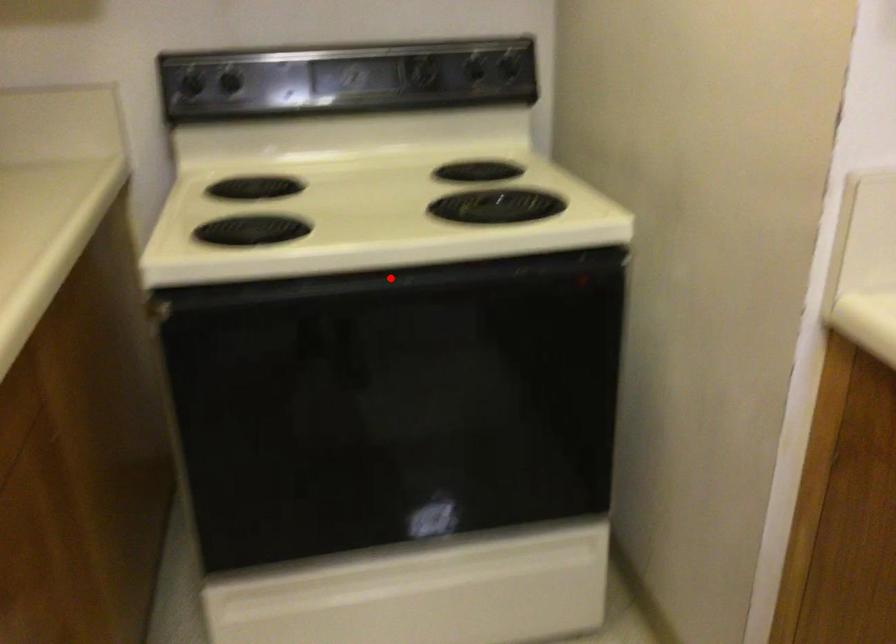
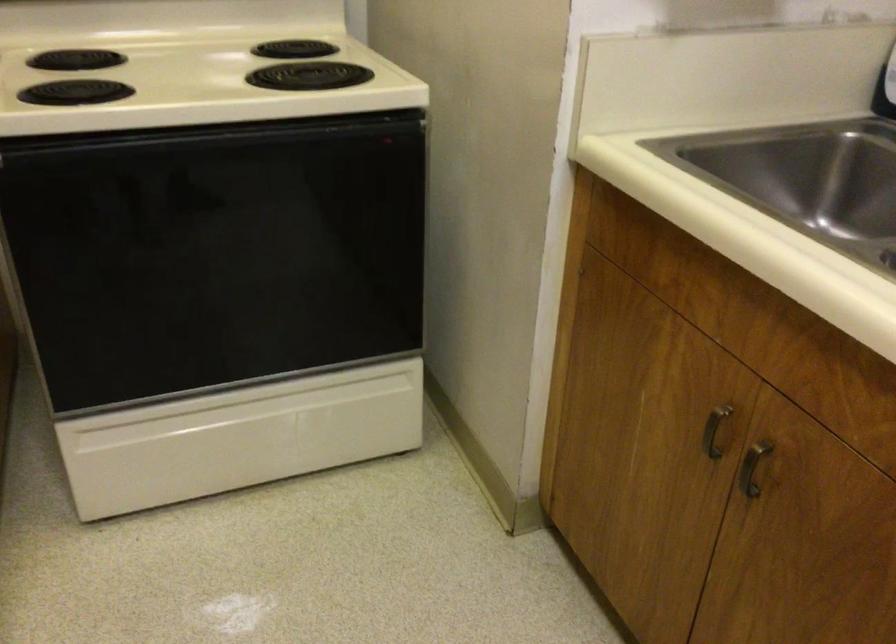
Where in the second image is the point corresponding to the highlighted location from the first image?

(213, 136)